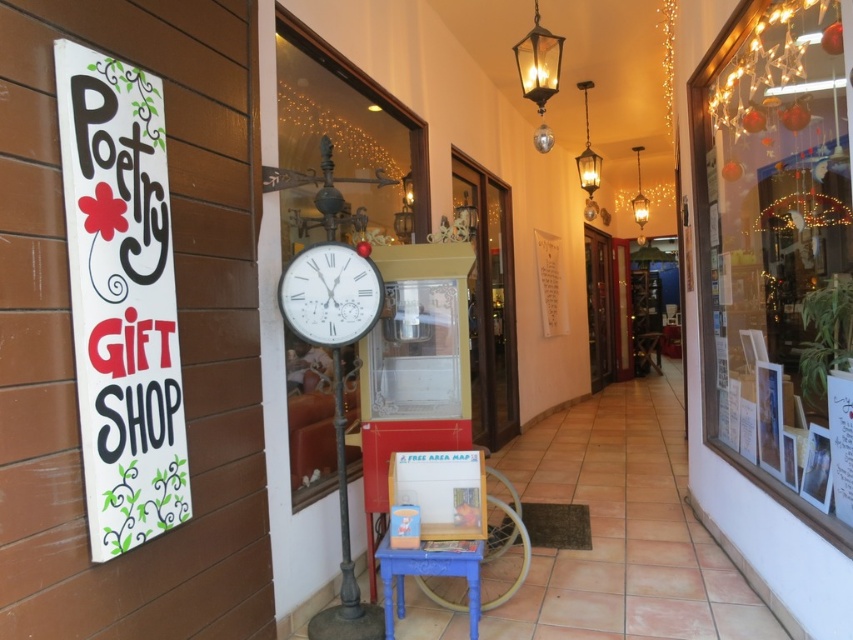
You are a customer entering the Poetry Gift Shop and want to see the items in the clear glass display case at right and the white painted wood sign at left. Which object would you look up towards first?

The clear glass display case at right is located above the white painted wood sign at left, so you would need to look up towards the clear glass display case at right first.

Based on the scene description, what object is located at the coordinates point (x=776, y=253)?

The clear glass display case at right is located at point (x=776, y=253).